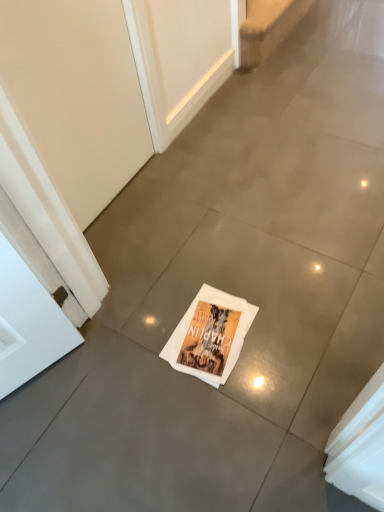
Question: Is beige matte screen door at upper left positioned in front of beige carpet at upper center?

Choices:
 (A) yes
 (B) no

Answer: (A)

Question: Is beige matte screen door at upper left oriented towards beige carpet at upper center?

Choices:
 (A) yes
 (B) no

Answer: (B)

Question: From the image's perspective, does beige matte screen door at upper left appear higher than beige carpet at upper center?

Choices:
 (A) yes
 (B) no

Answer: (B)

Question: Does beige matte screen door at upper left come behind beige carpet at upper center?

Choices:
 (A) no
 (B) yes

Answer: (A)

Question: Does beige matte screen door at upper left have a lesser height compared to beige carpet at upper center?

Choices:
 (A) yes
 (B) no

Answer: (B)

Question: Considering the relative sizes of beige matte screen door at upper left and beige carpet at upper center in the image provided, is beige matte screen door at upper left smaller than beige carpet at upper center?

Choices:
 (A) no
 (B) yes

Answer: (B)

Question: Does beige carpet at upper center have a greater height compared to beige matte screen door at upper left?

Choices:
 (A) yes
 (B) no

Answer: (B)

Question: From the image's perspective, is beige carpet at upper center located above beige matte screen door at upper left?

Choices:
 (A) yes
 (B) no

Answer: (A)

Question: Is beige carpet at upper center wider than beige matte screen door at upper left?

Choices:
 (A) no
 (B) yes

Answer: (B)

Question: Could beige matte screen door at upper left be considered to be inside beige carpet at upper center?

Choices:
 (A) yes
 (B) no

Answer: (B)

Question: Considering the relative positions of beige carpet at upper center and beige matte screen door at upper left in the image provided, is beige carpet at upper center to the left of beige matte screen door at upper left from the viewer's perspective?

Choices:
 (A) no
 (B) yes

Answer: (A)

Question: Considering the relative sizes of beige carpet at upper center and beige matte screen door at upper left in the image provided, is beige carpet at upper center bigger than beige matte screen door at upper left?

Choices:
 (A) no
 (B) yes

Answer: (B)

Question: Is beige carpet at upper center at the left side of white paper magazine at center?

Choices:
 (A) no
 (B) yes

Answer: (A)